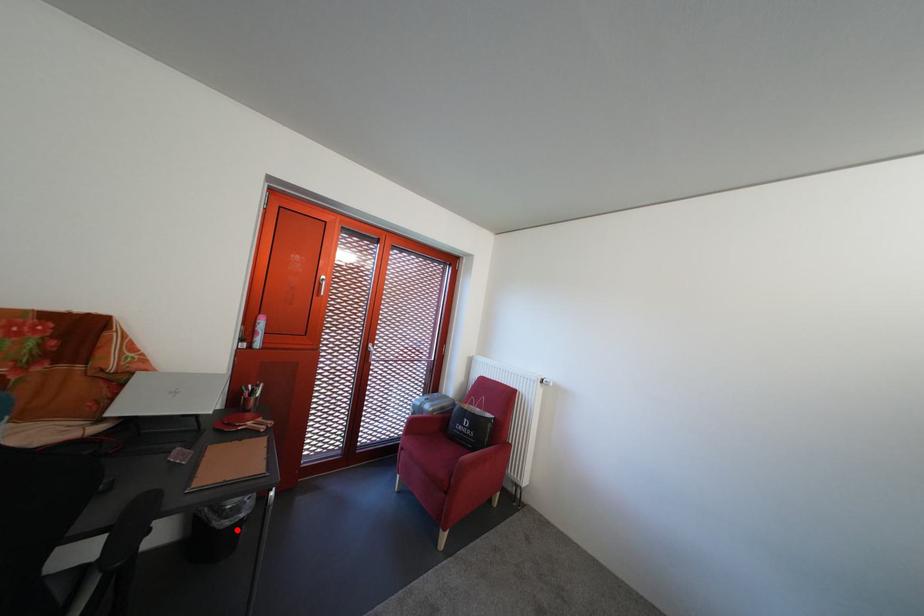
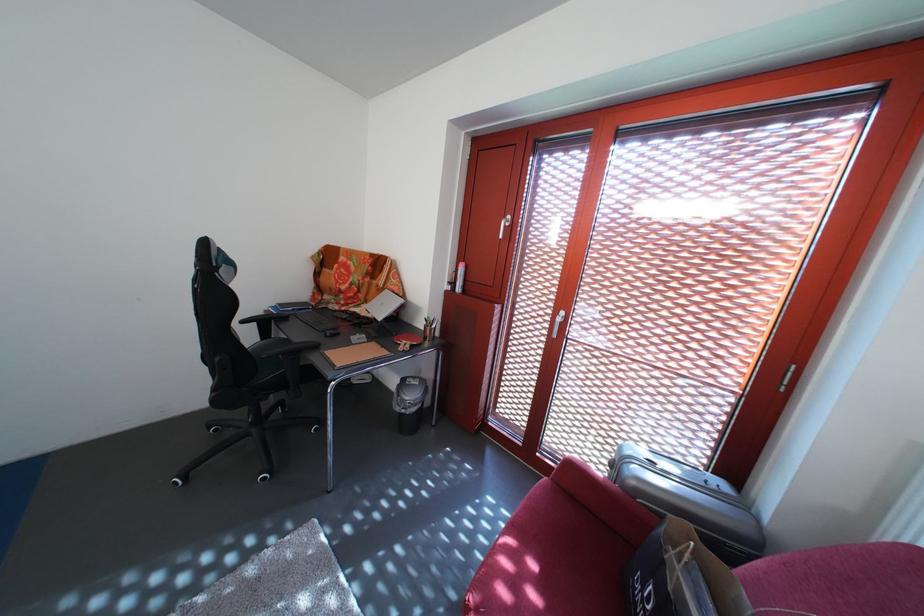
Where in the second image is the point corresponding to the highlighted location from the first image?

(408, 416)